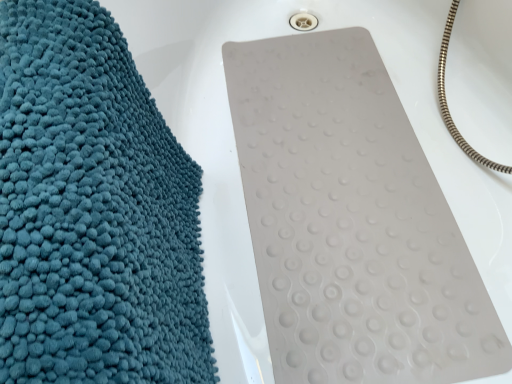
Find the location of `white rubber mat at center`. white rubber mat at center is located at coordinates (351, 222).

What do you see at coordinates (351, 222) in the screenshot? This screenshot has width=512, height=384. I see `white rubber mat at center` at bounding box center [351, 222].

You are a GUI agent. You are given a task and a screenshot of the screen. Output one action in this format:
    pyautogui.click(x=<x>, y=<y>)
    Task: Click on the teal fluffy towel at left
    The width and height of the screenshot is (512, 384).
    Given the screenshot: What is the action you would take?
    pyautogui.click(x=93, y=211)

In order to face teal fluffy towel at left, should I rotate leftwards or rightwards?

Turn left approximately 21.943 degrees to face it.

What do you see at coordinates (93, 211) in the screenshot? Image resolution: width=512 pixels, height=384 pixels. I see `teal fluffy towel at left` at bounding box center [93, 211].

Where is `white rubber mat at center`? Image resolution: width=512 pixels, height=384 pixels. white rubber mat at center is located at coordinates (351, 222).

Considering the relative positions of white rubber mat at center and teal fluffy towel at left in the image provided, is white rubber mat at center to the right of teal fluffy towel at left from the viewer's perspective?

Yes.

Relative to teal fluffy towel at left, is white rubber mat at center in front or behind?

Clearly, white rubber mat at center is behind teal fluffy towel at left.

Does point (276, 307) lie behind point (47, 138)?

Yes, it is behind point (47, 138).

From the image's perspective, which is below, white rubber mat at center or teal fluffy towel at left?

From the image's view, teal fluffy towel at left is below.

From a real-world perspective, which is physically above, white rubber mat at center or teal fluffy towel at left?

teal fluffy towel at left.

From the picture: Which of these two, white rubber mat at center or teal fluffy towel at left, is wider?

With larger width is white rubber mat at center.

Which of these two, white rubber mat at center or teal fluffy towel at left, stands taller?

teal fluffy towel at left.

Is white rubber mat at center bigger than teal fluffy towel at left?

Incorrect, white rubber mat at center is not larger than teal fluffy towel at left.

Which is correct: white rubber mat at center is inside teal fluffy towel at left, or outside of it?

white rubber mat at center is not enclosed by teal fluffy towel at left.

Are white rubber mat at center and teal fluffy towel at left located far from each other?

No, white rubber mat at center is in close proximity to teal fluffy towel at left.

Is white rubber mat at center oriented away from teal fluffy towel at left?

No, white rubber mat at center is not facing the opposite direction of teal fluffy towel at left.

Where is `towel below the white rubber mat at center (from the image's perspective)`? Image resolution: width=512 pixels, height=384 pixels. towel below the white rubber mat at center (from the image's perspective) is located at coordinates (93, 211).

Does teal fluffy towel at left appear on the left side of white rubber mat at center?

Yes, teal fluffy towel at left is to the left of white rubber mat at center.

Which object is closer to the camera, teal fluffy towel at left or white rubber mat at center?

teal fluffy towel at left.

Between point (22, 253) and point (298, 188), which one is positioned behind?

Point (298, 188)

From the image's perspective, is teal fluffy towel at left below white rubber mat at center?

Correct, teal fluffy towel at left appears lower than white rubber mat at center in the image.

From a real-world perspective, which is physically below, teal fluffy towel at left or white rubber mat at center?

From a 3D spatial view, white rubber mat at center is below.

Considering the sizes of teal fluffy towel at left and white rubber mat at center in the image, is teal fluffy towel at left wider or thinner than white rubber mat at center?

Clearly, teal fluffy towel at left has less width compared to white rubber mat at center.

Does teal fluffy towel at left have a greater height compared to white rubber mat at center?

Yes, teal fluffy towel at left is taller than white rubber mat at center.

Is teal fluffy towel at left smaller than white rubber mat at center?

No, teal fluffy towel at left is not smaller than white rubber mat at center.

Is teal fluffy towel at left not within white rubber mat at center?

Yes, teal fluffy towel at left is not within white rubber mat at center.

Is teal fluffy towel at left positioned far away from white rubber mat at center?

teal fluffy towel at left is actually quite close to white rubber mat at center.

Is teal fluffy towel at left facing towards white rubber mat at center?

No, teal fluffy towel at left does not turn towards white rubber mat at center.

Measure the distance between teal fluffy towel at left and white rubber mat at center.

A distance of 13.76 inches exists between teal fluffy towel at left and white rubber mat at center.

The image size is (512, 384). What are the coordinates of `towel positioned vertically above the white rubber mat at center (from a real-world perspective)` in the screenshot? It's located at (93, 211).

Where is `towel that appears above the white rubber mat at center (from a real-world perspective)`? This screenshot has width=512, height=384. towel that appears above the white rubber mat at center (from a real-world perspective) is located at coordinates (x=93, y=211).

You are a GUI agent. You are given a task and a screenshot of the screen. Output one action in this format:
    pyautogui.click(x=<x>, y=<y>)
    Task: Click on the bath towel above the teal fluffy towel at left (from the image's perspective)
    The height and width of the screenshot is (384, 512).
    Given the screenshot: What is the action you would take?
    pyautogui.click(x=351, y=222)